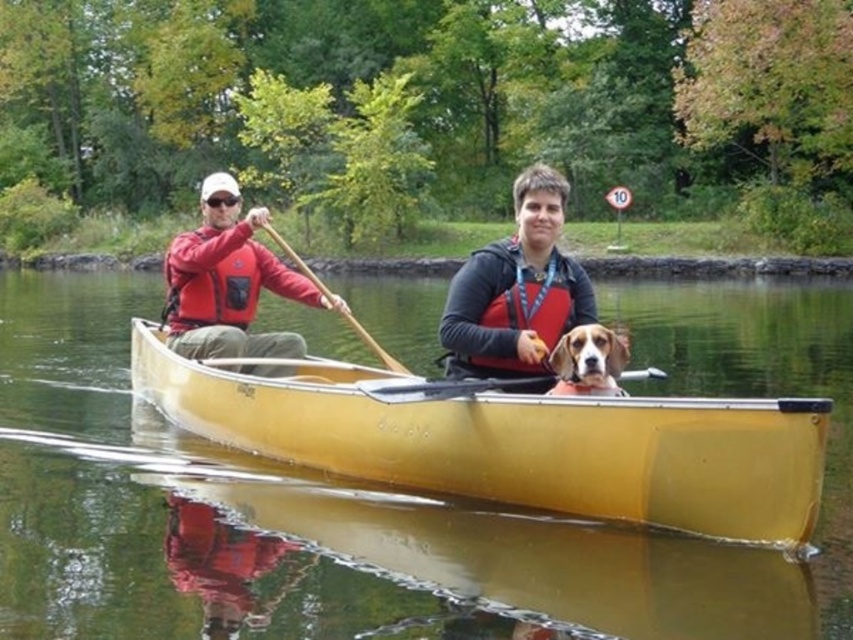
Can you confirm if wooden paddle at center is positioned to the left of wooden paddle at left?

In fact, wooden paddle at center is to the right of wooden paddle at left.

Is point (523, 385) less distant than point (277, 244)?

Yes.

What do you see at coordinates (444, 387) in the screenshot?
I see `wooden paddle at center` at bounding box center [444, 387].

Identify the location of wooden paddle at center. This screenshot has height=640, width=853. point(444,387).

Can you confirm if yellow plastic canoe at center is shorter than matte red life vest at center?

Correct, yellow plastic canoe at center is not as tall as matte red life vest at center.

Consider the image. Which is below, yellow plastic canoe at center or matte red life vest at center?

Positioned lower is yellow plastic canoe at center.

The width and height of the screenshot is (853, 640). Describe the element at coordinates (514, 442) in the screenshot. I see `yellow plastic canoe at center` at that location.

You are a GUI agent. You are given a task and a screenshot of the screen. Output one action in this format:
    pyautogui.click(x=<x>, y=<y>)
    Task: Click on the yellow plastic canoe at center
    
    Given the screenshot: What is the action you would take?
    point(514,442)

Is yellow plastic canoe at center to the left of red matte life jacket at left from the viewer's perspective?

Incorrect, yellow plastic canoe at center is not on the left side of red matte life jacket at left.

Is yellow plastic canoe at center thinner than red matte life jacket at left?

Yes.

Where is `yellow plastic canoe at center`? Image resolution: width=853 pixels, height=640 pixels. yellow plastic canoe at center is located at coordinates (514, 442).